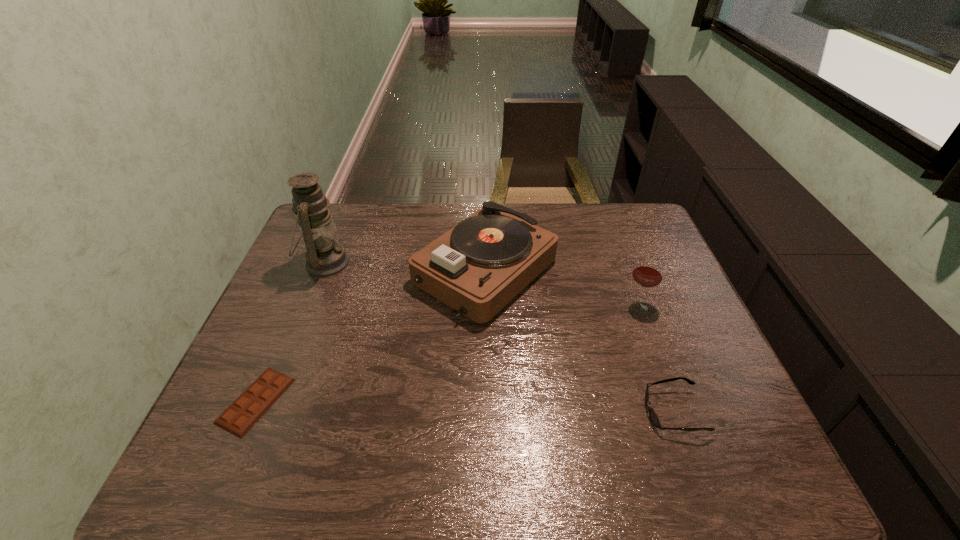
Identify the location of vacant space located 0.060m on the lenses of the sunglasses. This screenshot has width=960, height=540. (618, 411).

Find the location of a particular element. free region located 0.170m on the right of the shortest object is located at coordinates (363, 401).

Locate an element on the screen. object that is at the far edge is located at coordinates (477, 267).

Image resolution: width=960 pixels, height=540 pixels. In order to click on oil lamp that is at the left edge in this screenshot , I will do `click(325, 258)`.

Where is `chocolate bar that is at the left edge`? This screenshot has height=540, width=960. chocolate bar that is at the left edge is located at coordinates (248, 408).

Locate an element on the screen. wineglass at the right edge is located at coordinates (648, 273).

What are the coordinates of `sunglasses located at the right edge` in the screenshot? It's located at (653, 416).

At what (x,y) coordinates should I click in order to perform the action: click on free location at the left edge. Please return your answer as a coordinate pair (x, y). This screenshot has height=540, width=960. Looking at the image, I should click on [303, 282].

I want to click on vacant space at the right edge, so click(x=682, y=415).

In the image, there is a desktop. Identify the location of vacant space at the far left corner. (339, 231).